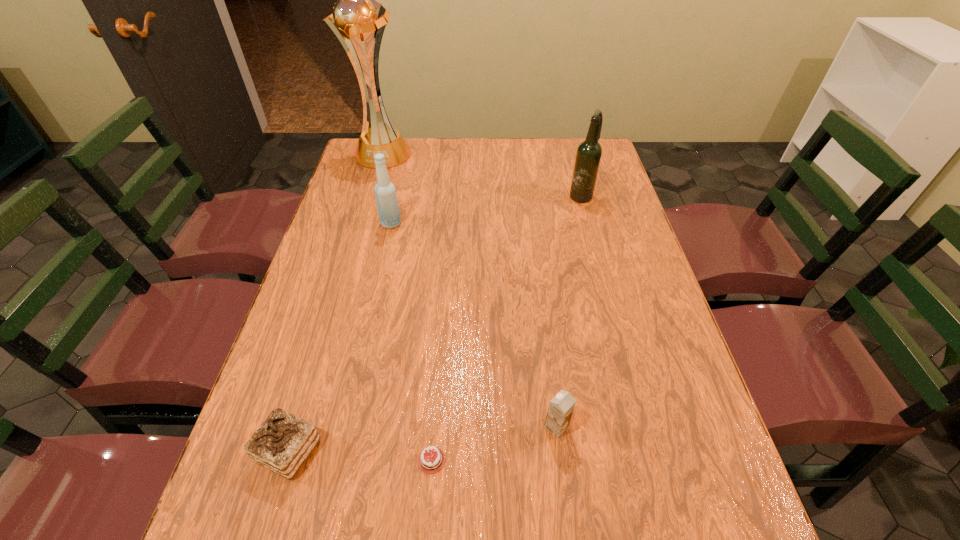
The image size is (960, 540). In order to click on trophy in this screenshot , I will do `click(357, 15)`.

Where is `the tallest object`? the tallest object is located at coordinates (357, 15).

What are the coordinates of `beer bottle` in the screenshot? It's located at (588, 156).

Identify the location of the second tallest object. (588, 156).

Where is `bottle`? Image resolution: width=960 pixels, height=540 pixels. bottle is located at coordinates (388, 209).

This screenshot has height=540, width=960. I want to click on the fourth nearest object, so click(x=388, y=209).

The height and width of the screenshot is (540, 960). I want to click on chocolate milk, so click(x=561, y=407).

Where is `the fifth object from left to right`? The height and width of the screenshot is (540, 960). the fifth object from left to right is located at coordinates click(x=561, y=407).

You are a GUI agent. You are given a task and a screenshot of the screen. Output one action in this format:
    pyautogui.click(x=<x>, y=<y>)
    Task: Click on the taller chocolate cake
    This screenshot has width=960, height=540.
    Given the screenshot: What is the action you would take?
    pyautogui.click(x=282, y=443)

The width and height of the screenshot is (960, 540). I want to click on the second shortest object, so click(x=282, y=443).